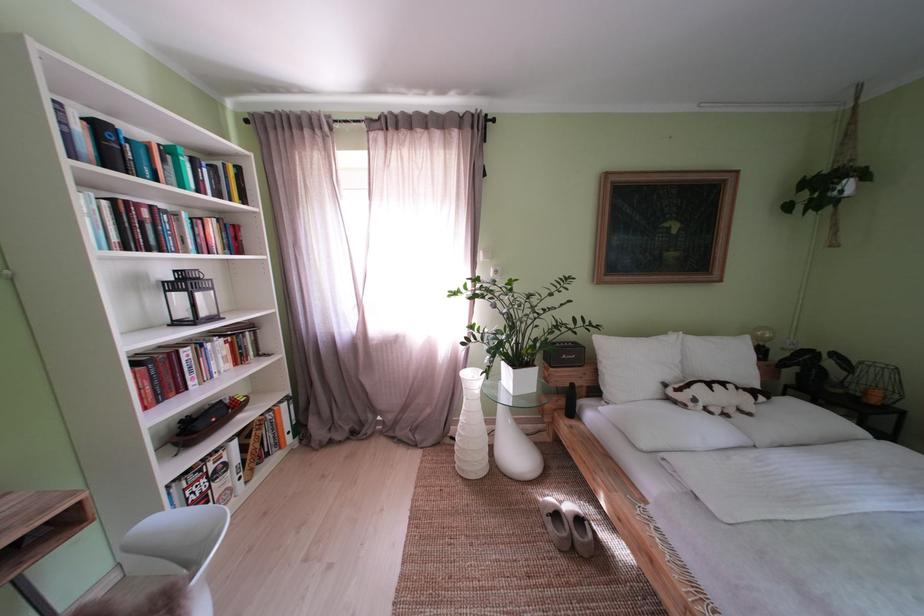
Describe the element at coordinates (137, 586) in the screenshot. This screenshot has width=924, height=616. I see `a white chair sitting surface` at that location.